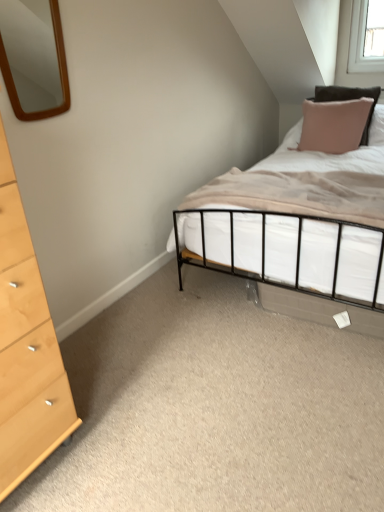
Question: From a real-world perspective, is pink fabric pillow at upper right beneath wooden mirror at upper left?

Choices:
 (A) no
 (B) yes

Answer: (B)

Question: Does pink fabric pillow at upper right have a greater height compared to wooden mirror at upper left?

Choices:
 (A) no
 (B) yes

Answer: (B)

Question: Is pink fabric pillow at upper right in contact with wooden mirror at upper left?

Choices:
 (A) no
 (B) yes

Answer: (A)

Question: Does pink fabric pillow at upper right appear on the left side of wooden mirror at upper left?

Choices:
 (A) yes
 (B) no

Answer: (B)

Question: Is pink fabric pillow at upper right closer to camera compared to wooden mirror at upper left?

Choices:
 (A) no
 (B) yes

Answer: (A)

Question: Is wooden mirror at upper left bigger or smaller than beige fabric mattress at center?

Choices:
 (A) small
 (B) big

Answer: (A)

Question: Looking at their shapes, would you say wooden mirror at upper left is wider or thinner than beige fabric mattress at center?

Choices:
 (A) thin
 (B) wide

Answer: (A)

Question: From a real-world perspective, is wooden mirror at upper left above or below beige fabric mattress at center?

Choices:
 (A) below
 (B) above

Answer: (B)

Question: Considering their positions, is wooden mirror at upper left located in front of or behind beige fabric mattress at center?

Choices:
 (A) behind
 (B) front

Answer: (B)

Question: Would you say beige fabric mattress at center is to the left or to the right of pink fabric pillow at upper right in the picture?

Choices:
 (A) right
 (B) left

Answer: (B)

Question: Relative to pink fabric pillow at upper right, is beige fabric mattress at center in front or behind?

Choices:
 (A) front
 (B) behind

Answer: (A)

Question: Is beige fabric mattress at center inside the boundaries of pink fabric pillow at upper right, or outside?

Choices:
 (A) outside
 (B) inside

Answer: (A)

Question: Considering the positions of point (367, 201) and point (355, 121), is point (367, 201) closer or farther from the camera than point (355, 121)?

Choices:
 (A) farther
 (B) closer

Answer: (B)

Question: Visually, is pink fabric pillow at upper right positioned to the left or to the right of light wood/texture chest of drawers at left?

Choices:
 (A) right
 (B) left

Answer: (A)

Question: From a real-world perspective, relative to light wood/texture chest of drawers at left, is pink fabric pillow at upper right vertically above or below?

Choices:
 (A) below
 (B) above

Answer: (B)